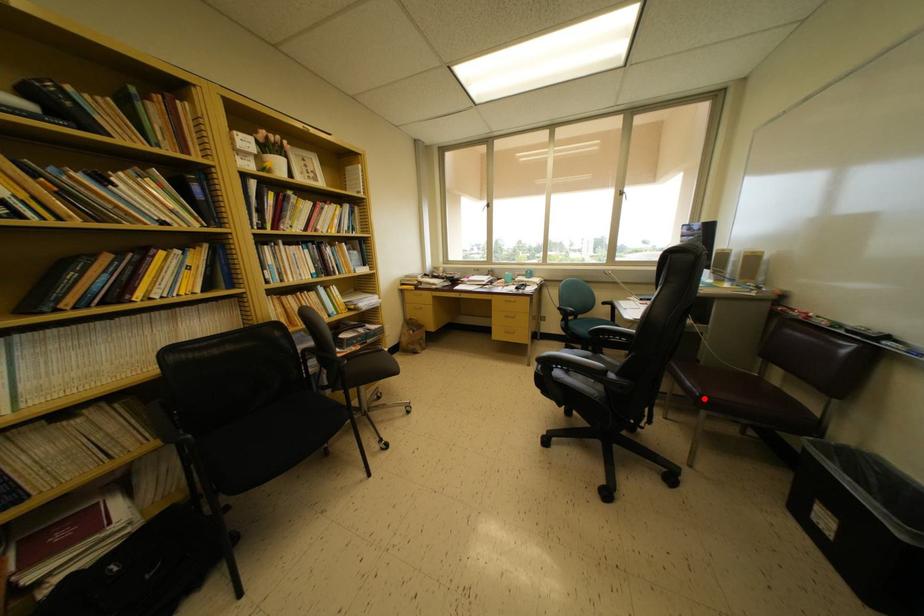
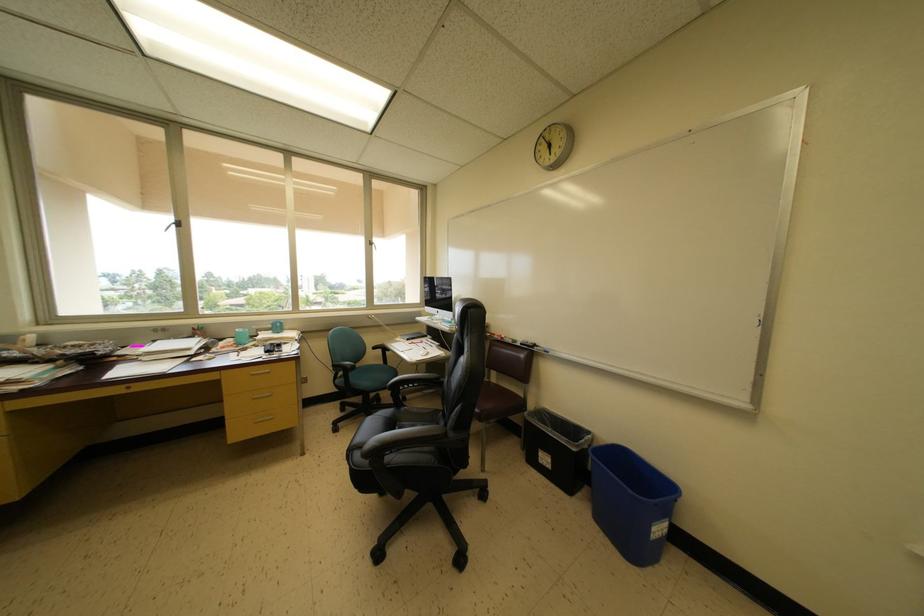
Question: I am providing you with two images of the same scene from different viewpoints. Image1 has a red point marked. In image2, the corresponding 3D location appears at what relative position? Reply with the corresponding letter.

Choices:
 (A) Closer
 (B) Farther

Answer: (B)